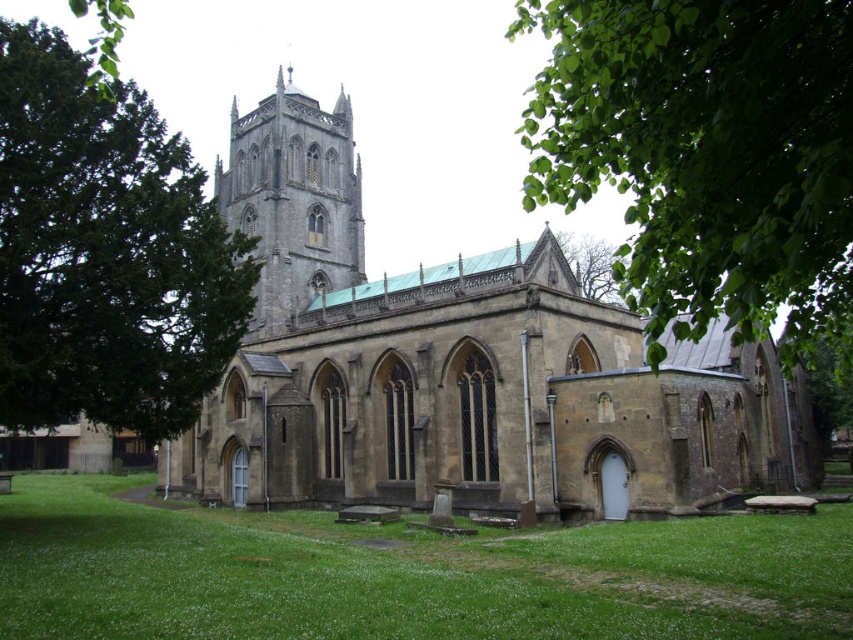
Question: Does green leafy tree at upper right appear under stone tower at center?

Choices:
 (A) yes
 (B) no

Answer: (A)

Question: Among these points, which one is farthest from the camera?

Choices:
 (A) (358, 563)
 (B) (573, 433)

Answer: (B)

Question: Is brown stone church at center to the right of green leafy tree at upper right from the viewer's perspective?

Choices:
 (A) no
 (B) yes

Answer: (A)

Question: Can you confirm if green leafy tree at left is positioned to the left of green leafy tree at upper center?

Choices:
 (A) no
 (B) yes

Answer: (B)

Question: Based on their relative distances, which object is nearer to the green leafy tree at left?

Choices:
 (A) brown stone church at center
 (B) green leafy tree at upper center
 (C) stone tower at center
 (D) green leafy tree at upper right

Answer: (A)

Question: Estimate the real-world distances between objects in this image. Which object is farther from the green grass at lower center?

Choices:
 (A) green leafy tree at upper center
 (B) green leafy tree at upper right
 (C) green leafy tree at left

Answer: (A)